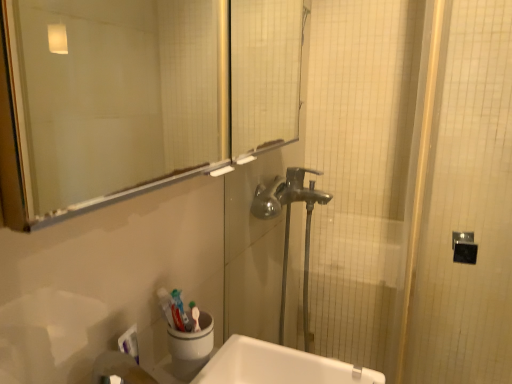
Question: Could you tell me if transparent glass mirror at upper center is facing white glossy sink at lower center?

Choices:
 (A) no
 (B) yes

Answer: (A)

Question: Can you confirm if transparent glass mirror at upper center is shorter than white glossy sink at lower center?

Choices:
 (A) no
 (B) yes

Answer: (A)

Question: From a real-world perspective, is transparent glass mirror at upper center located higher than white glossy sink at lower center?

Choices:
 (A) no
 (B) yes

Answer: (B)

Question: Does transparent glass mirror at upper center appear on the right side of white glossy sink at lower center?

Choices:
 (A) yes
 (B) no

Answer: (B)

Question: Does transparent glass mirror at upper center have a greater height compared to white glossy sink at lower center?

Choices:
 (A) no
 (B) yes

Answer: (B)

Question: In terms of width, does polished chrome faucet at center look wider or thinner when compared to transparent glass mirror at upper center?

Choices:
 (A) thin
 (B) wide

Answer: (A)

Question: From the image's perspective, is polished chrome faucet at center above or below transparent glass mirror at upper center?

Choices:
 (A) below
 (B) above

Answer: (A)

Question: Is point (288, 188) positioned closer to the camera than point (70, 77)?

Choices:
 (A) closer
 (B) farther

Answer: (A)

Question: Considering the positions of polished chrome faucet at center and transparent glass mirror at upper center in the image, is polished chrome faucet at center taller or shorter than transparent glass mirror at upper center?

Choices:
 (A) tall
 (B) short

Answer: (A)

Question: Based on their positions, is polished chrome faucet at center located to the left or right of white glossy sink at lower center?

Choices:
 (A) right
 (B) left

Answer: (A)

Question: Considering the positions of polished chrome faucet at center and white glossy sink at lower center in the image, is polished chrome faucet at center taller or shorter than white glossy sink at lower center?

Choices:
 (A) tall
 (B) short

Answer: (A)

Question: Is point (287, 203) closer or farther from the camera than point (244, 347)?

Choices:
 (A) closer
 (B) farther

Answer: (B)

Question: Is polished chrome faucet at center bigger or smaller than white glossy sink at lower center?

Choices:
 (A) small
 (B) big

Answer: (B)

Question: From the image's perspective, relative to transparent glass mirror at upper center, is white glossy sink at lower center above or below?

Choices:
 (A) below
 (B) above

Answer: (A)

Question: From a real-world perspective, is white glossy sink at lower center physically located above or below transparent glass mirror at upper center?

Choices:
 (A) above
 (B) below

Answer: (B)